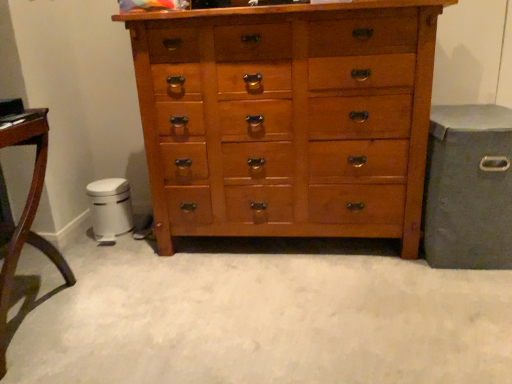
What do you see at coordinates (25, 213) in the screenshot? I see `mahogany wood table at left` at bounding box center [25, 213].

I want to click on brushed metal trash can at lower left, so click(110, 209).

Is wooden chest of drawers at center in front of or behind matte gray storage bin at right in the image?

In the image, wooden chest of drawers at center appears in front of matte gray storage bin at right.

Could you tell me if wooden chest of drawers at center is turned towards matte gray storage bin at right?

No, wooden chest of drawers at center is not turned towards matte gray storage bin at right.

Which is behind, point (205, 136) or point (439, 214)?

The point (205, 136) is farther from the camera.

Between wooden chest of drawers at center and matte gray storage bin at right, which one has larger width?

Wider between the two is matte gray storage bin at right.

Considering the relative sizes of brushed metal trash can at lower left and wooden chest of drawers at center in the image provided, is brushed metal trash can at lower left shorter than wooden chest of drawers at center?

Yes, brushed metal trash can at lower left is shorter than wooden chest of drawers at center.

Who is bigger, brushed metal trash can at lower left or wooden chest of drawers at center?

wooden chest of drawers at center.

Is brushed metal trash can at lower left in front of or behind wooden chest of drawers at center in the image?

In the image, brushed metal trash can at lower left appears behind wooden chest of drawers at center.

Is brushed metal trash can at lower left positioned with its back to wooden chest of drawers at center?

No, wooden chest of drawers at center is not at the back of brushed metal trash can at lower left.

Which object is positioned more to the right, wooden chest of drawers at center or brushed metal trash can at lower left?

Positioned to the right is wooden chest of drawers at center.

From the picture: How different are the orientations of wooden chest of drawers at center and brushed metal trash can at lower left in degrees?

The facing directions of wooden chest of drawers at center and brushed metal trash can at lower left are 0.517 degrees apart.

Is wooden chest of drawers at center situated inside brushed metal trash can at lower left or outside?

wooden chest of drawers at center cannot be found inside brushed metal trash can at lower left.

From the picture: Does matte gray storage bin at right have a larger size compared to mahogany wood table at left?

Indeed, matte gray storage bin at right has a larger size compared to mahogany wood table at left.

Does matte gray storage bin at right turn towards mahogany wood table at left?

No, matte gray storage bin at right is not aimed at mahogany wood table at left.

How far apart are matte gray storage bin at right and mahogany wood table at left?

5.10 feet.

Would you say matte gray storage bin at right is to the left or to the right of mahogany wood table at left in the picture?

matte gray storage bin at right is positioned on mahogany wood table at left's right side.

Is brushed metal trash can at lower left not inside matte gray storage bin at right?

Absolutely, brushed metal trash can at lower left is external to matte gray storage bin at right.

Is brushed metal trash can at lower left positioned behind matte gray storage bin at right?

Yes, the depth of brushed metal trash can at lower left is greater than that of matte gray storage bin at right.

Consider the image. Can you confirm if brushed metal trash can at lower left is thinner than matte gray storage bin at right?

Indeed, brushed metal trash can at lower left has a lesser width compared to matte gray storage bin at right.

Who is bigger, matte gray storage bin at right or brushed metal trash can at lower left?

matte gray storage bin at right is bigger.

Which object is thinner, matte gray storage bin at right or brushed metal trash can at lower left?

Thinner between the two is brushed metal trash can at lower left.

Is matte gray storage bin at right inside or outside of brushed metal trash can at lower left?

matte gray storage bin at right is located beyond the bounds of brushed metal trash can at lower left.

Does point (36, 117) appear closer or farther from the camera than point (294, 190)?

Point (36, 117) is positioned closer to the camera compared to point (294, 190).

Considering the positions of objects mahogany wood table at left and wooden chest of drawers at center in the image provided, who is in front, mahogany wood table at left or wooden chest of drawers at center?

mahogany wood table at left is closer to the camera.

From the picture: From the image's perspective, is mahogany wood table at left located above or below wooden chest of drawers at center?

mahogany wood table at left is situated lower than wooden chest of drawers at center in the image.

Is mahogany wood table at left placed right next to wooden chest of drawers at center?

mahogany wood table at left and wooden chest of drawers at center are not in contact.

Locate an element on the screen. Image resolution: width=512 pixels, height=384 pixels. gray located below the wooden chest of drawers at center (from the image's perspective) is located at coordinates (468, 187).

At what (x,y) coordinates should I click in order to perform the action: click on chest of drawers above the brushed metal trash can at lower left (from a real-world perspective). Please return your answer as a coordinate pair (x, y). Looking at the image, I should click on (287, 119).

Considering their positions, is mahogany wood table at left positioned further to brushed metal trash can at lower left than matte gray storage bin at right?

matte gray storage bin at right is further to brushed metal trash can at lower left.

Considering their positions, is brushed metal trash can at lower left positioned closer to mahogany wood table at left than matte gray storage bin at right?

brushed metal trash can at lower left.

Estimate the real-world distances between objects in this image. Which object is further from wooden chest of drawers at center, matte gray storage bin at right or mahogany wood table at left?

Based on the image, mahogany wood table at left appears to be further to wooden chest of drawers at center.

When comparing their distances from wooden chest of drawers at center, does mahogany wood table at left or brushed metal trash can at lower left seem further?

mahogany wood table at left is positioned further to the anchor wooden chest of drawers at center.

Which object lies further to the anchor point matte gray storage bin at right, mahogany wood table at left or wooden chest of drawers at center?

Among the two, mahogany wood table at left is located further to matte gray storage bin at right.

Looking at the image, which one is located closer to wooden chest of drawers at center, brushed metal trash can at lower left or mahogany wood table at left?

brushed metal trash can at lower left is positioned closer to the anchor wooden chest of drawers at center.

From the image, which object appears to be nearer to brushed metal trash can at lower left, wooden chest of drawers at center or matte gray storage bin at right?

wooden chest of drawers at center lies closer to brushed metal trash can at lower left than the other object.

Based on their spatial positions, is wooden chest of drawers at center or mahogany wood table at left closer to brushed metal trash can at lower left?

Among the two, mahogany wood table at left is located nearer to brushed metal trash can at lower left.

Find the location of a particular element. music stool between mahogany wood table at left and wooden chest of drawers at center is located at coordinates (110, 209).

You are a GUI agent. You are given a task and a screenshot of the screen. Output one action in this format:
    pyautogui.click(x=<x>, y=<y>)
    Task: Click on the chest of drawers between brushed metal trash can at lower left and matte gray storage bin at right
    The image size is (512, 384).
    Given the screenshot: What is the action you would take?
    pyautogui.click(x=287, y=119)

Where is `music stool between mahogany wood table at left and matte gray storage bin at right`? music stool between mahogany wood table at left and matte gray storage bin at right is located at coordinates (110, 209).

I want to click on the chest of drawers situated between mahogany wood table at left and matte gray storage bin at right from left to right, so click(x=287, y=119).